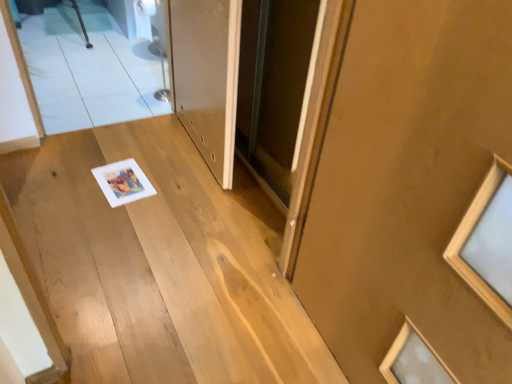
Where is `matte brown door at center, the second door positioned from the left`? matte brown door at center, the second door positioned from the left is located at coordinates (408, 184).

This screenshot has width=512, height=384. What do you see at coordinates (90, 68) in the screenshot?
I see `clear glass mirror at upper left` at bounding box center [90, 68].

Find the location of `white glossy door at center, the 2th door positioned from the right`. white glossy door at center, the 2th door positioned from the right is located at coordinates (207, 76).

Is matte brown door at center, the second door in the back-to-front sequence, not close to white glossy door at center, marked as the 1th door in a left-to-right arrangement?

No, there isn't a large distance between matte brown door at center, the second door in the back-to-front sequence, and white glossy door at center, marked as the 1th door in a left-to-right arrangement.

Find the location of a particular element. The image size is (512, 384). door below the white glossy door at center, which is the 1th door from back to front (from the image's perspective) is located at coordinates (408, 184).

What's the angular difference between matte brown door at center, the second door in the back-to-front sequence, and white glossy door at center, which ranks as the second door in front-to-back order,'s facing directions?

They differ by 1.06 degrees in their facing directions.

Considering their positions, is wooden stairs at center located in front of or behind clear glass mirror at upper left?

In the image, wooden stairs at center appears in front of clear glass mirror at upper left.

From a real-world perspective, who is located higher, wooden stairs at center or clear glass mirror at upper left?

clear glass mirror at upper left is physically above.

Considering the sizes of objects wooden stairs at center and clear glass mirror at upper left in the image provided, who is wider, wooden stairs at center or clear glass mirror at upper left?

wooden stairs at center is wider.

Measure the distance from wooden stairs at center to clear glass mirror at upper left.

The distance of wooden stairs at center from clear glass mirror at upper left is 1.10 meters.

Is white glossy door at center, which is the 1th door from back to front, placed right next to clear glass mirror at upper left?

There is a gap between white glossy door at center, which is the 1th door from back to front, and clear glass mirror at upper left.

Which point is more forward, (225, 62) or (79, 68)?

Positioned in front is point (225, 62).

From a real-world perspective, who is located lower, white glossy door at center, which ranks as the second door in front-to-back order, or clear glass mirror at upper left?

From a 3D spatial view, clear glass mirror at upper left is below.

Is white glossy door at center, marked as the 1th door in a left-to-right arrangement, further to the viewer compared to clear glass mirror at upper left?

That is False.

Is matte brown door at center, which is the first door in right-to-left order, next to wooden stairs at center?

No, matte brown door at center, which is the first door in right-to-left order, is not in contact with wooden stairs at center.

Would you say matte brown door at center, which is the first door in right-to-left order, contains wooden stairs at center?

No.

From a real-world perspective, is matte brown door at center, which is the first door in right-to-left order, positioned above or below wooden stairs at center?

From a real-world perspective, matte brown door at center, which is the first door in right-to-left order, is physically above wooden stairs at center.

In the scene shown: Is matte brown door at center, the second door in the back-to-front sequence, smaller than wooden stairs at center?

Yes, matte brown door at center, the second door in the back-to-front sequence, is smaller than wooden stairs at center.

Between clear glass mirror at upper left and wooden stairs at center, which one has more height?

With more height is clear glass mirror at upper left.

Is wooden stairs at center inside clear glass mirror at upper left?

Yes, wooden stairs at center is a part of clear glass mirror at upper left.

In terms of width, does clear glass mirror at upper left look wider or thinner when compared to wooden stairs at center?

Clearly, clear glass mirror at upper left has less width compared to wooden stairs at center.

Could you tell me if clear glass mirror at upper left is turned towards wooden stairs at center?

Yes, clear glass mirror at upper left is turned towards wooden stairs at center.

Between white glossy door at center, the 2th door positioned from the right, and matte brown door at center, the second door positioned from the left, which one is positioned behind?

white glossy door at center, the 2th door positioned from the right, is further away from the camera.

Is white glossy door at center, marked as the 1th door in a left-to-right arrangement, wider than matte brown door at center, the second door positioned from the left?

Correct, the width of white glossy door at center, marked as the 1th door in a left-to-right arrangement, exceeds that of matte brown door at center, the second door positioned from the left.

Considering the relative positions of white glossy door at center, marked as the 1th door in a left-to-right arrangement, and matte brown door at center, the 1th door when ordered from front to back, in the image provided, is white glossy door at center, marked as the 1th door in a left-to-right arrangement, to the left of matte brown door at center, the 1th door when ordered from front to back, from the viewer's perspective?

Yes.

Is white glossy door at center, the 2th door positioned from the right, oriented away from matte brown door at center, the second door positioned from the left?

No, matte brown door at center, the second door positioned from the left, is not at the back of white glossy door at center, the 2th door positioned from the right.

Are clear glass mirror at upper left and white glossy door at center, the 2th door positioned from the right, located far from each other?

No, clear glass mirror at upper left is not far away from white glossy door at center, the 2th door positioned from the right.

Which of these two, clear glass mirror at upper left or white glossy door at center, which is the 1th door from back to front, is smaller?

With smaller size is white glossy door at center, which is the 1th door from back to front.

Considering the relative sizes of clear glass mirror at upper left and white glossy door at center, which is the 1th door from back to front, in the image provided, is clear glass mirror at upper left shorter than white glossy door at center, which is the 1th door from back to front,?

Yes, clear glass mirror at upper left is shorter than white glossy door at center, which is the 1th door from back to front.

Considering the positions of point (83, 102) and point (193, 132), is point (83, 102) closer or farther from the camera than point (193, 132)?

Clearly, point (83, 102) is more distant from the camera than point (193, 132).

Where is `door located underneath the matte brown door at center, the second door positioned from the left (from a real-world perspective)`? door located underneath the matte brown door at center, the second door positioned from the left (from a real-world perspective) is located at coordinates (207, 76).

What are the coordinates of `stairs on the right side of clear glass mirror at upper left` in the screenshot? It's located at (161, 264).

Estimate the real-world distances between objects in this image. Which object is further from wooden stairs at center, white glossy door at center, which ranks as the second door in front-to-back order, or matte brown door at center, the second door in the back-to-front sequence?

Among the two, matte brown door at center, the second door in the back-to-front sequence, is located further to wooden stairs at center.

When comparing their distances from clear glass mirror at upper left, does matte brown door at center, the 1th door when ordered from front to back, or wooden stairs at center seem further?

matte brown door at center, the 1th door when ordered from front to back, is positioned further to the anchor clear glass mirror at upper left.

Which object lies nearer to the anchor point wooden stairs at center, matte brown door at center, the 1th door when ordered from front to back, or white glossy door at center, the 2th door positioned from the right?

white glossy door at center, the 2th door positioned from the right, is positioned closer to the anchor wooden stairs at center.

Estimate the real-world distances between objects in this image. Which object is closer to white glossy door at center, which is the 1th door from back to front, wooden stairs at center or clear glass mirror at upper left?

wooden stairs at center is closer to white glossy door at center, which is the 1th door from back to front.

Which object lies nearer to the anchor point wooden stairs at center, white glossy door at center, the 2th door positioned from the right, or clear glass mirror at upper left?

The object closer to wooden stairs at center is white glossy door at center, the 2th door positioned from the right.

From the image, which object appears to be farther from clear glass mirror at upper left, white glossy door at center, which is the 1th door from back to front, or wooden stairs at center?

wooden stairs at center is further to clear glass mirror at upper left.

When comparing their distances from white glossy door at center, which is the 1th door from back to front, does matte brown door at center, the second door in the back-to-front sequence, or wooden stairs at center seem further?

matte brown door at center, the second door in the back-to-front sequence, is further to white glossy door at center, which is the 1th door from back to front.

Estimate the real-world distances between objects in this image. Which object is closer to white glossy door at center, which ranks as the second door in front-to-back order, matte brown door at center, the second door positioned from the left, or clear glass mirror at upper left?

matte brown door at center, the second door positioned from the left.

In order to click on door positioned between matte brown door at center, which is the first door in right-to-left order, and clear glass mirror at upper left from near to far in this screenshot , I will do `click(207, 76)`.

Where is `stairs between matte brown door at center, the 1th door when ordered from front to back, and clear glass mirror at upper left, along the z-axis`? The image size is (512, 384). stairs between matte brown door at center, the 1th door when ordered from front to back, and clear glass mirror at upper left, along the z-axis is located at coordinates (161, 264).

Find the location of a particular element. The image size is (512, 384). stairs between matte brown door at center, the second door in the back-to-front sequence, and white glossy door at center, marked as the 1th door in a left-to-right arrangement, from front to back is located at coordinates (161, 264).

I want to click on door between wooden stairs at center and clear glass mirror at upper left in the front-back direction, so click(207, 76).